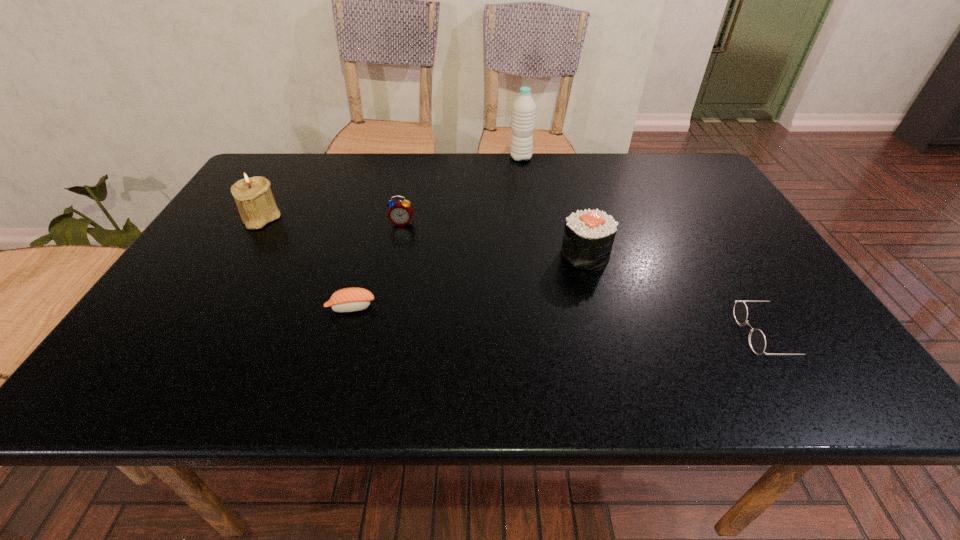
Locate an element on the screen. object that is at the left edge is located at coordinates (253, 196).

At what (x,y) coordinates should I click in order to perform the action: click on object that is at the right edge. Please return your answer as a coordinate pair (x, y). The height and width of the screenshot is (540, 960). Looking at the image, I should click on (757, 341).

Image resolution: width=960 pixels, height=540 pixels. What are the coordinates of `object that is at the near right corner` in the screenshot? It's located at (757, 341).

The image size is (960, 540). Identify the location of blank space at the far edge of the desktop. [x=542, y=154].

Locate an element on the screen. Image resolution: width=960 pixels, height=540 pixels. vacant region at the near edge of the desktop is located at coordinates (768, 383).

Identify the location of vacant space at the right edge. This screenshot has height=540, width=960. (693, 239).

What are the coordinates of `vacant area at the far left corner of the desktop` in the screenshot? It's located at (280, 156).

Locate an element on the screen. This screenshot has width=960, height=540. free space at the far right corner of the desktop is located at coordinates (681, 190).

Locate an element on the screen. free space between the fourth farthest object and the left sushi is located at coordinates (468, 281).

Locate an element on the screen. This screenshot has width=960, height=540. blank region between the tallest object and the fifth shortest object is located at coordinates (391, 188).